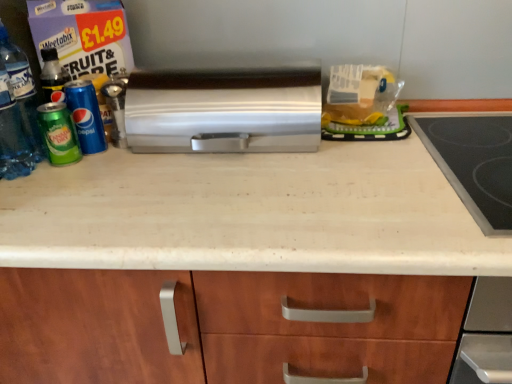
Where is `blank space situated above white laminate countertop at center (from a real-world perspective)`? Image resolution: width=512 pixels, height=384 pixels. blank space situated above white laminate countertop at center (from a real-world perspective) is located at coordinates (280, 177).